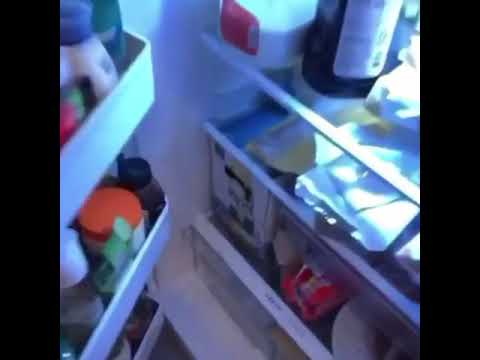
The image size is (480, 360). What are the coordinates of `bottle` in the screenshot? It's located at (122, 351).